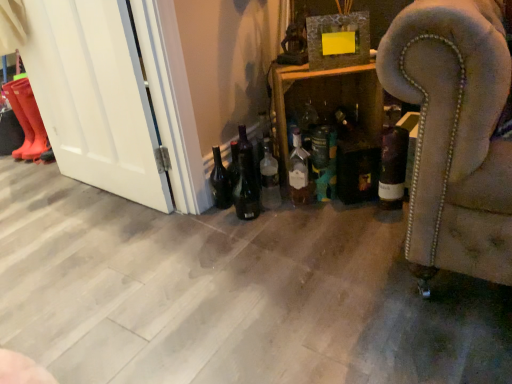
Find the location of a particular element. The image size is (512, 384). free space between translucent glass bottle at center, placed as the first bottle when sorted from left to right, and matte glass bottle at center, which appears as the 2th bottle when viewed from the left is located at coordinates (293, 203).